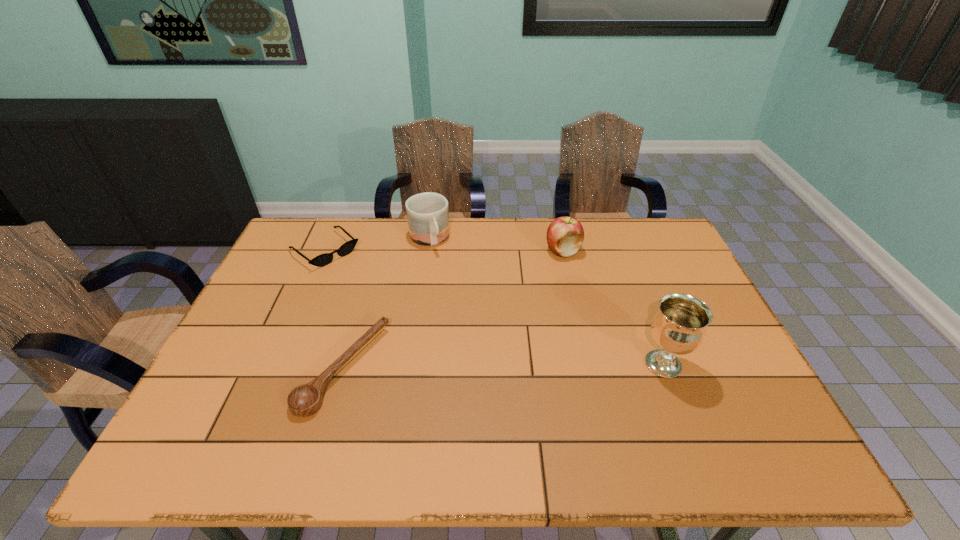
Identify the location of vacant space on the desktop that is between the wooden spoon and the tallest object and is positioned on the side with the handle of the mug. The height and width of the screenshot is (540, 960). (490, 367).

This screenshot has height=540, width=960. I want to click on vacant spot on the desktop that is between the wooden spoon and the rightmost object and is positioned on the bitten side of the second object from right to left, so (x=481, y=367).

Locate an element on the screen. vacant space on the desktop that is between the wooden spoon and the chalice and is positioned on the front-facing side of the sunglasses is located at coordinates [464, 367].